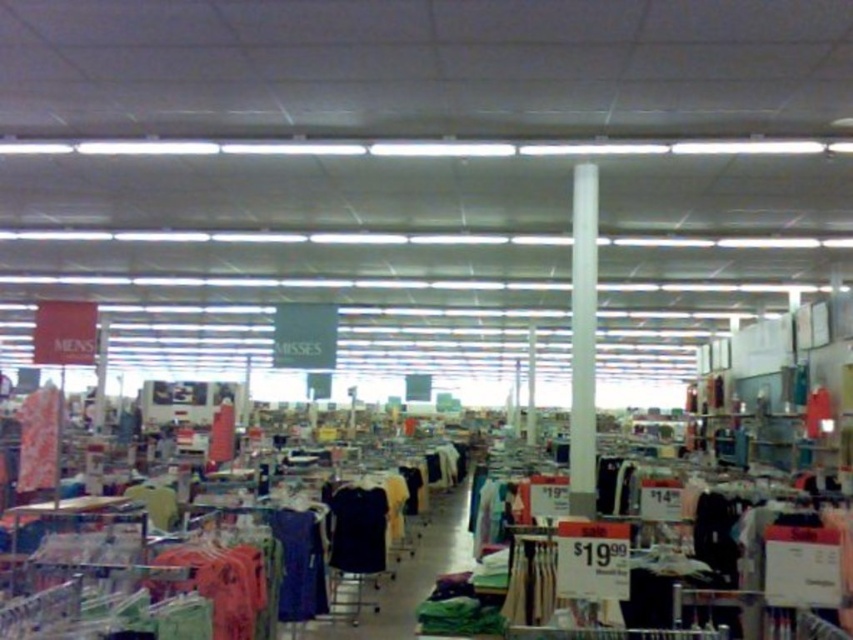
Question: Does dark blue fabric dress at center appear on the right side of dark blue fabric shirt at center?

Choices:
 (A) yes
 (B) no

Answer: (B)

Question: Which of the following is the farthest from the observer?

Choices:
 (A) dark blue fabric dress at center
 (B) striped fabric shirt at left

Answer: (A)

Question: Is dark blue fabric dress at center smaller than striped fabric shirt at left?

Choices:
 (A) no
 (B) yes

Answer: (A)

Question: Can you confirm if dark blue fabric dress at center is positioned below striped fabric shirt at left?

Choices:
 (A) yes
 (B) no

Answer: (A)

Question: Among these points, which one is farthest from the camera?

Choices:
 (A) (51, 468)
 (B) (361, 513)
 (C) (274, 513)

Answer: (B)

Question: Which point is closer to the camera?

Choices:
 (A) dark blue fabric dress at center
 (B) striped fabric shirt at left
 (C) dark blue fabric shirt at center

Answer: (B)